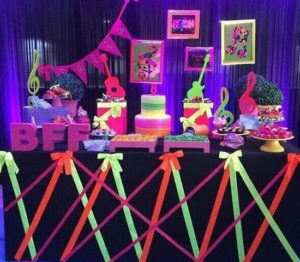
Identify the location of ribbon. The image size is (300, 262). (232, 155).